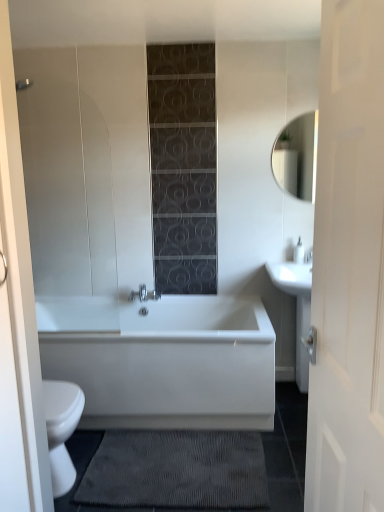
At what (x,y) coordinates should I click in order to perform the action: click on vacant area on top of dark gray textured bath mat at lower center (from a real-world perspective). Please return your answer as a coordinate pair (x, y). Looking at the image, I should click on (210, 466).